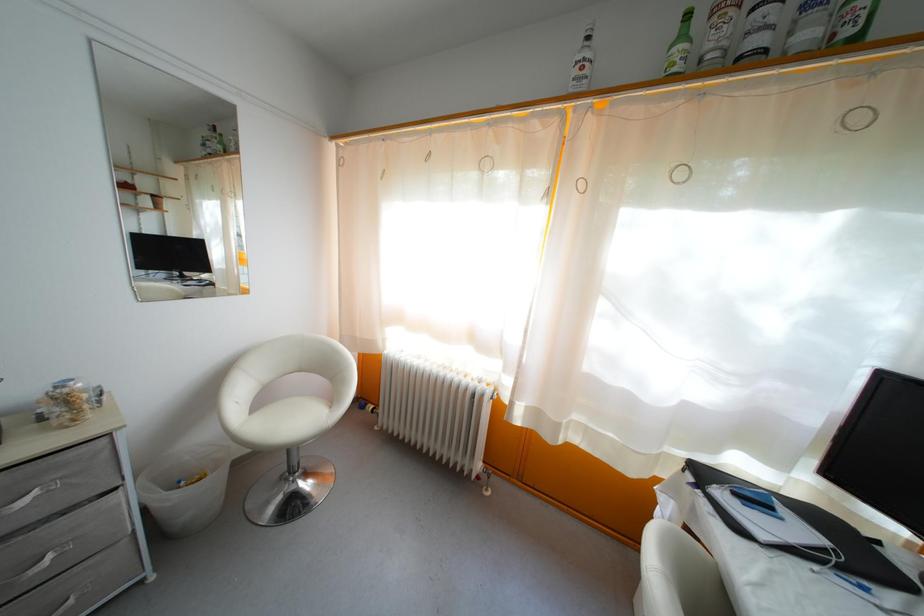
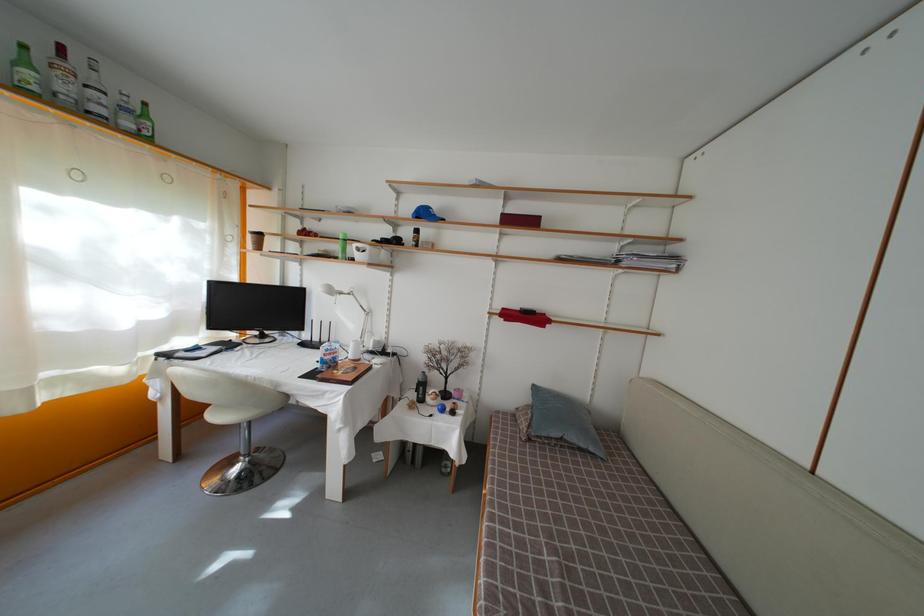
In the second image, find the point that corresponds to (x=745, y=65) in the first image.

(94, 119)